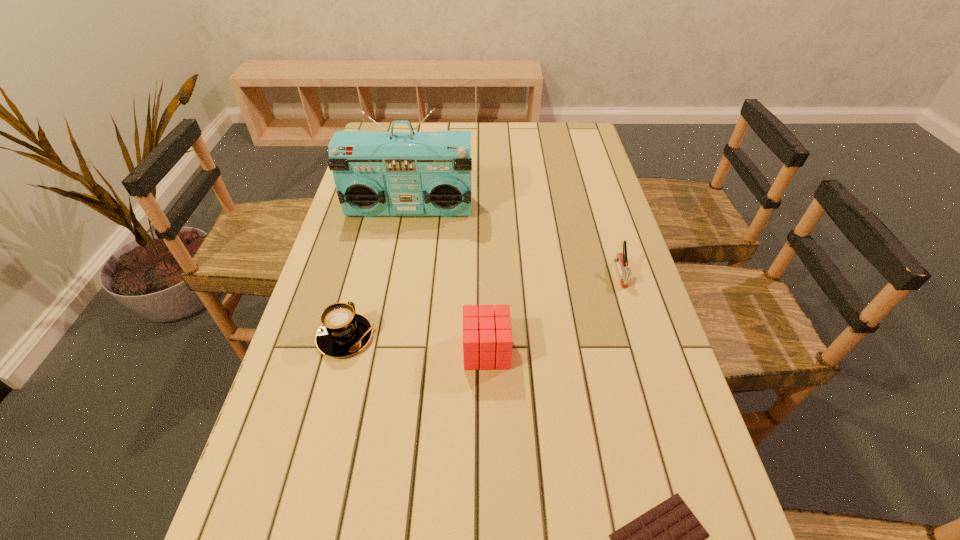
Where is `the farthest object`? The height and width of the screenshot is (540, 960). the farthest object is located at coordinates (412, 173).

At what (x,y) coordinates should I click in order to perform the action: click on the tallest object. Please return your answer as a coordinate pair (x, y). Image resolution: width=960 pixels, height=540 pixels. Looking at the image, I should click on (412, 173).

Image resolution: width=960 pixels, height=540 pixels. What are the coordinates of `cube` in the screenshot? It's located at (490, 340).

The height and width of the screenshot is (540, 960). Find the location of `the second farthest object`. the second farthest object is located at coordinates (621, 260).

Where is `cappuccino`? Image resolution: width=960 pixels, height=540 pixels. cappuccino is located at coordinates 343,332.

Locate an element on the screen. free spot located on the front-facing side of the tallest object is located at coordinates (389, 328).

This screenshot has width=960, height=540. Find the location of `free space located 0.080m on the front of the cube`. free space located 0.080m on the front of the cube is located at coordinates (487, 406).

At what (x,y) coordinates should I click in order to perform the action: click on free location located on the handle side of the stapler. Please return your answer as a coordinate pair (x, y). This screenshot has height=540, width=960. Looking at the image, I should click on (673, 446).

At what (x,y) coordinates should I click in order to perform the action: click on vacant region located on the back of the cappuccino. Please return your answer as a coordinate pair (x, y). Looking at the image, I should click on (358, 290).

Identify the location of radio receiver that is positioned at the left edge. The height and width of the screenshot is (540, 960). (412, 173).